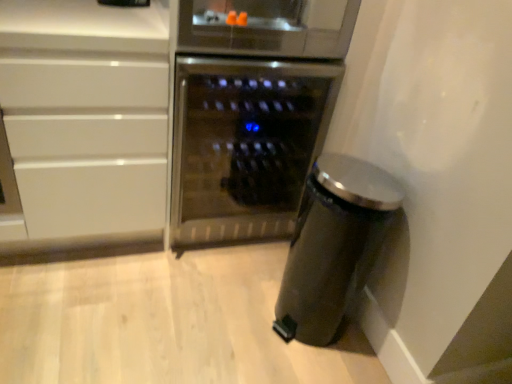
Question: Are white glossy cabinet at left and stainless steel wine cooler at center located far from each other?

Choices:
 (A) no
 (B) yes

Answer: (A)

Question: Considering the relative positions of white glossy cabinet at left and stainless steel wine cooler at center in the image provided, is white glossy cabinet at left to the right of stainless steel wine cooler at center from the viewer's perspective?

Choices:
 (A) yes
 (B) no

Answer: (B)

Question: Can stainless steel wine cooler at center be found inside white glossy cabinet at left?

Choices:
 (A) no
 (B) yes

Answer: (A)

Question: Does white glossy cabinet at left have a greater width compared to stainless steel wine cooler at center?

Choices:
 (A) no
 (B) yes

Answer: (B)

Question: Is white glossy cabinet at left touching stainless steel wine cooler at center?

Choices:
 (A) yes
 (B) no

Answer: (B)

Question: Is stainless steel wine cooler at center in front of or behind satin black trash can at lower right in the image?

Choices:
 (A) front
 (B) behind

Answer: (B)

Question: Is stainless steel wine cooler at center wider or thinner than satin black trash can at lower right?

Choices:
 (A) thin
 (B) wide

Answer: (B)

Question: Visually, is stainless steel wine cooler at center positioned to the left or to the right of satin black trash can at lower right?

Choices:
 (A) right
 (B) left

Answer: (B)

Question: From a real-world perspective, is stainless steel wine cooler at center positioned above or below satin black trash can at lower right?

Choices:
 (A) above
 (B) below

Answer: (A)

Question: In the image, is satin black trash can at lower right positioned in front of or behind stainless steel wine cooler at center?

Choices:
 (A) front
 (B) behind

Answer: (A)

Question: Would you say satin black trash can at lower right is to the left or to the right of stainless steel wine cooler at center in the picture?

Choices:
 (A) right
 (B) left

Answer: (A)

Question: In terms of width, does satin black trash can at lower right look wider or thinner when compared to stainless steel wine cooler at center?

Choices:
 (A) wide
 (B) thin

Answer: (B)

Question: Considering the positions of satin black trash can at lower right and stainless steel wine cooler at center in the image, is satin black trash can at lower right taller or shorter than stainless steel wine cooler at center?

Choices:
 (A) short
 (B) tall

Answer: (A)

Question: Is satin black trash can at lower right spatially inside white glossy cabinet at left, or outside of it?

Choices:
 (A) outside
 (B) inside

Answer: (A)

Question: In the image, is satin black trash can at lower right on the left side or the right side of white glossy cabinet at left?

Choices:
 (A) right
 (B) left

Answer: (A)